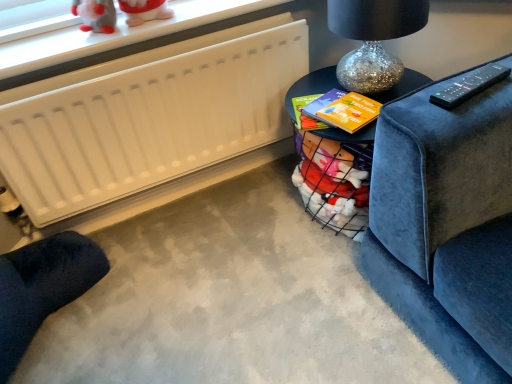
This screenshot has width=512, height=384. I want to click on free point to the right of dark blue fabric footrest at lower left, so click(x=164, y=302).